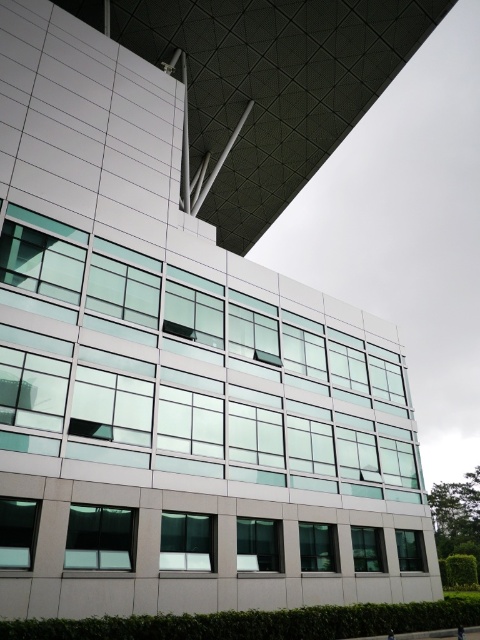
Measure the distance from transparent glass window at center to transparent glass window at lower center.

A distance of 1.66 meters exists between transparent glass window at center and transparent glass window at lower center.

Who is lower down, transparent glass window at center or transparent glass window at lower center?

transparent glass window at lower center

Describe the element at coordinates (186, 541) in the screenshot. Image resolution: width=480 pixels, height=640 pixels. I see `transparent glass window at center` at that location.

The image size is (480, 640). What are the coordinates of `transparent glass window at center` in the screenshot? It's located at (186, 541).

Is transparent glass window at upper left to the left of transparent glass window at lower right from the viewer's perspective?

Indeed, transparent glass window at upper left is positioned on the left side of transparent glass window at lower right.

Based on the photo, how far apart are transparent glass window at upper left and transparent glass window at lower right?

The distance of transparent glass window at upper left from transparent glass window at lower right is 14.86 meters.

Locate an element on the screen. The image size is (480, 640). transparent glass window at upper left is located at coordinates (40, 262).

At what (x,y) coordinates should I click in order to perform the action: click on transparent glass window at upper left. Please return your answer as a coordinate pair (x, y). Looking at the image, I should click on [40, 262].

Who is shorter, clear glass window at lower center or clear glass window at lower right?

With less height is clear glass window at lower right.

Between point (316, 532) and point (361, 572), which one is positioned behind?

Point (361, 572)

At what (x,y) coordinates should I click in order to perform the action: click on clear glass window at lower center. Please return your answer as a coordinate pair (x, y). Looking at the image, I should click on (317, 547).